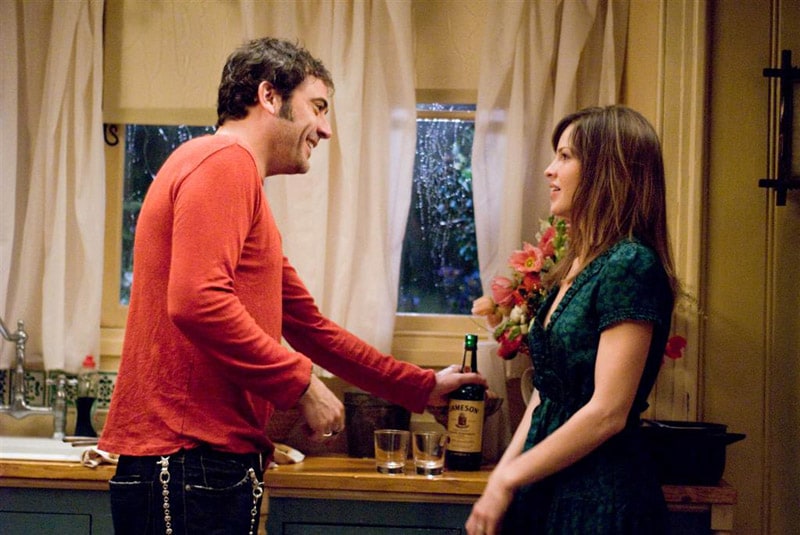
You are a GUI agent. You are given a task and a screenshot of the screen. Output one action in this format:
    pyautogui.click(x=<x>, y=<y>)
    Task: Click on the counter top
    This screenshot has width=800, height=535.
    Given the screenshot: What is the action you would take?
    pyautogui.click(x=324, y=468)